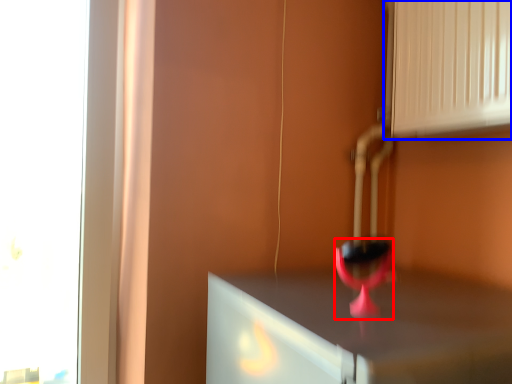
Question: Which object is further to the camera taking this photo, wine glass (highlighted by a red box) or vent (highlighted by a blue box)?

Choices:
 (A) wine glass
 (B) vent

Answer: (B)